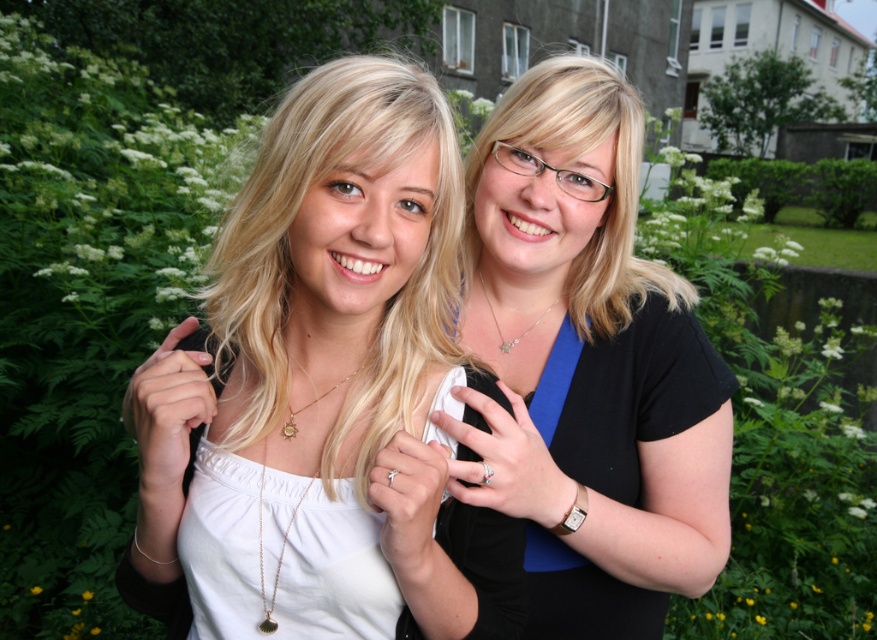
Where is the white matte shirt at center located in the image?

The white matte shirt at center is located at point 0.613 on the x axis and 0.369 on the y axis.

You are standing in a garden and want to place a small bench between the two points marked as point (214, 344) and point (610, 532). Which point should the bench be closer to in order to be nearer to the person on the left?

The bench should be closer to point (214, 344) because it is closer to the viewer than point (610, 532), making it nearer to the person on the left.

You are a photographer at a formal event and need to position two guests for a photo. The guests are wearing the white matte shirt at center and the black matte shirt at center. According to the scene, which guest should stand to the left side of the photo to match their current positions?

The white matte shirt at center should stand to the left side of the photo because it is already positioned to the left of the black matte shirt at center in the current scene.